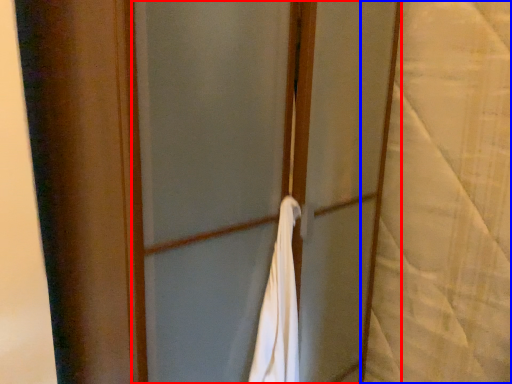
Question: Which object appears closest to the camera in this image, screen door (highlighted by a red box) or curtain (highlighted by a blue box)?

Choices:
 (A) screen door
 (B) curtain

Answer: (A)